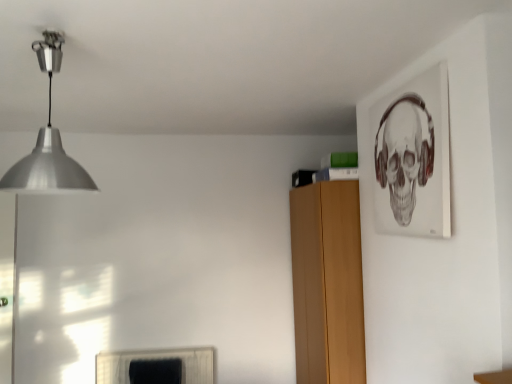
Question: From the image's perspective, is silver metallic pendant light at upper left located beneath matte paper skull at upper right?

Choices:
 (A) yes
 (B) no

Answer: (B)

Question: Is matte paper skull at upper right a part of silver metallic pendant light at upper left?

Choices:
 (A) no
 (B) yes

Answer: (A)

Question: From a real-world perspective, is silver metallic pendant light at upper left located beneath matte paper skull at upper right?

Choices:
 (A) yes
 (B) no

Answer: (B)

Question: Is silver metallic pendant light at upper left positioned in front of matte paper skull at upper right?

Choices:
 (A) no
 (B) yes

Answer: (B)

Question: From a real-world perspective, is silver metallic pendant light at upper left over matte paper skull at upper right?

Choices:
 (A) yes
 (B) no

Answer: (A)

Question: Is there a large distance between silver metallic pendant light at upper left and matte paper skull at upper right?

Choices:
 (A) no
 (B) yes

Answer: (B)

Question: Considering the relative sizes of matte paper skull at upper right and silver metallic pendant light at upper left in the image provided, is matte paper skull at upper right bigger than silver metallic pendant light at upper left?

Choices:
 (A) no
 (B) yes

Answer: (A)

Question: Can you confirm if matte paper skull at upper right is positioned to the left of silver metallic pendant light at upper left?

Choices:
 (A) no
 (B) yes

Answer: (A)

Question: From the image's perspective, does matte paper skull at upper right appear higher than silver metallic pendant light at upper left?

Choices:
 (A) no
 (B) yes

Answer: (A)

Question: Is matte paper skull at upper right smaller than silver metallic pendant light at upper left?

Choices:
 (A) no
 (B) yes

Answer: (B)

Question: Considering the relative sizes of matte paper skull at upper right and silver metallic pendant light at upper left in the image provided, is matte paper skull at upper right thinner than silver metallic pendant light at upper left?

Choices:
 (A) no
 (B) yes

Answer: (B)

Question: Is matte paper skull at upper right not close to silver metallic pendant light at upper left?

Choices:
 (A) yes
 (B) no

Answer: (A)

Question: From the image's perspective, relative to silver metallic pendant light at upper left, is matte paper skull at upper right above or below?

Choices:
 (A) above
 (B) below

Answer: (B)